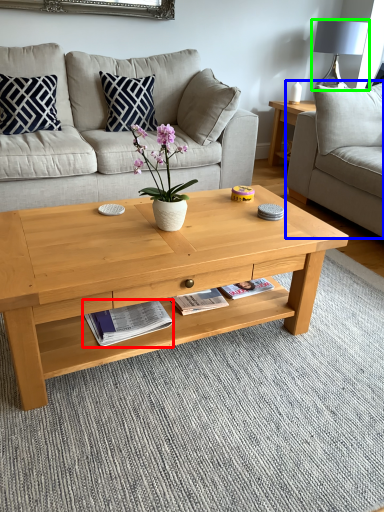
Question: Which object is the farthest from magazine (highlighted by a red box)? Choose among these: studio couch (highlighted by a blue box) or lamp (highlighted by a green box).

Choices:
 (A) studio couch
 (B) lamp

Answer: (B)